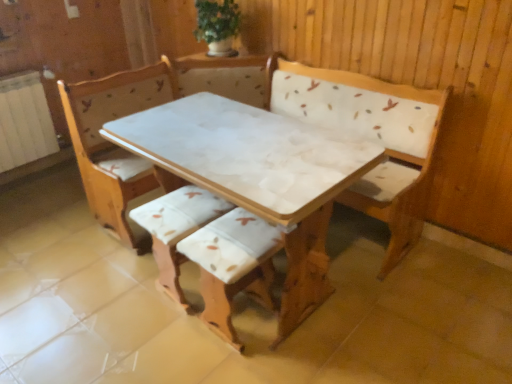
You are a GUI agent. You are given a task and a screenshot of the screen. Output one action in this format:
    pyautogui.click(x=<x>, y=<y>)
    Task: Click on the free space in front of white fabric cushion at center, which is the 2th armchair from right to left
    This screenshot has height=384, width=512.
    Given the screenshot: What is the action you would take?
    pyautogui.click(x=161, y=339)